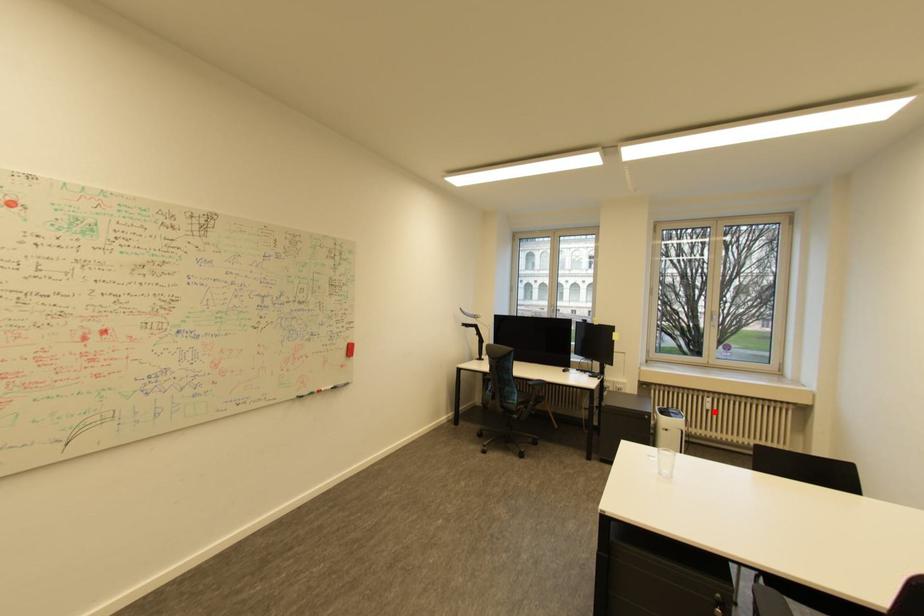
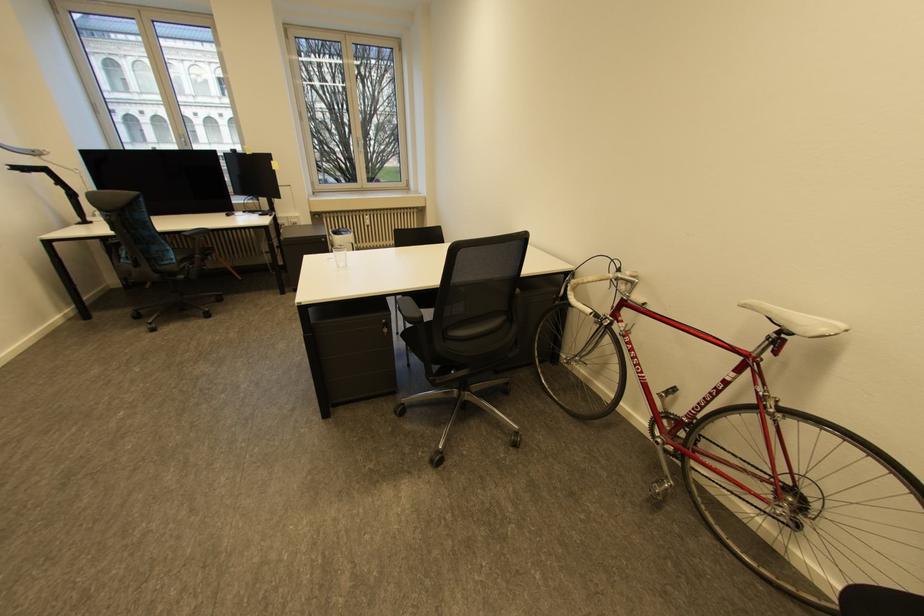
In the second image, find the point that corresponds to the highlighted location in the first image.

(374, 227)